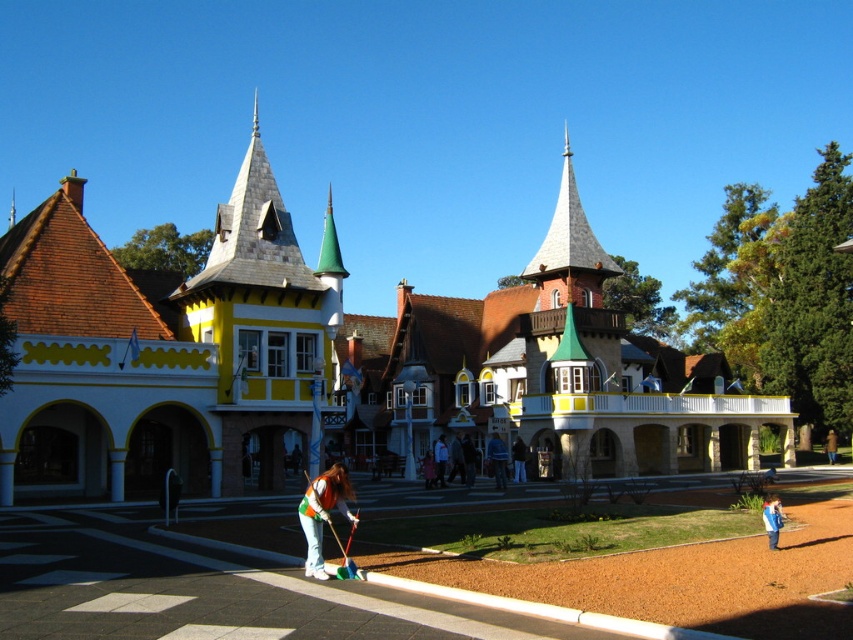
You are a tour guide leading a group near the fairy tale building. You notice two people wearing green fabric clothing at the center. The first person is wearing a shirt, and the second is wearing a jacket. Your group wants to take a photo that includes both individuals. Given that your camera has a maximum focus range of 25 meters, will you be able to capture both the green fabric shirt at center and the green fabric jacket at center in the same photo?

The distance between the green fabric shirt at center and the green fabric jacket at center is 24.75 meters. Since the camera can focus up to 25 meters, both individuals can be included in the photo as the distance is within the camera range.

Looking at this image, you are an artist planning to paint the fairy tale building complex. You need to decide which clothing item to highlight in your painting because it is bigger. Which one should you choose between the green fabric shirt at center and the blue fabric jacket at lower right?

The green fabric shirt at center has a larger size compared to the blue fabric jacket at lower right, so you should highlight the green fabric shirt at center in your painting.

Based on the photo, you are standing in front of the fairy tale building complex and notice two people wearing jackets. The first person is wearing a green fabric jacket at center and the other is wearing a blue fabric jacket at lower right. Which jacket is taller?

The green fabric jacket at center is taller than the blue fabric jacket at lower right.